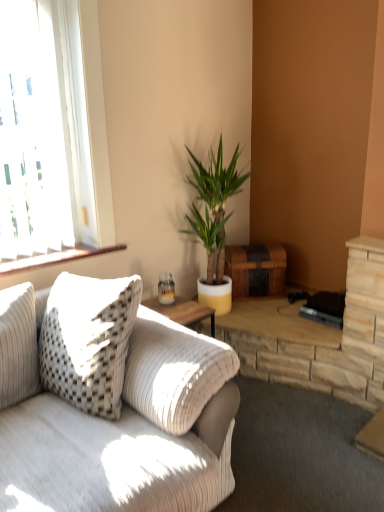
Where is `empty space that is ontop of wooden at left (from a real-world perspective)`? The height and width of the screenshot is (512, 384). empty space that is ontop of wooden at left (from a real-world perspective) is located at coordinates coord(50,253).